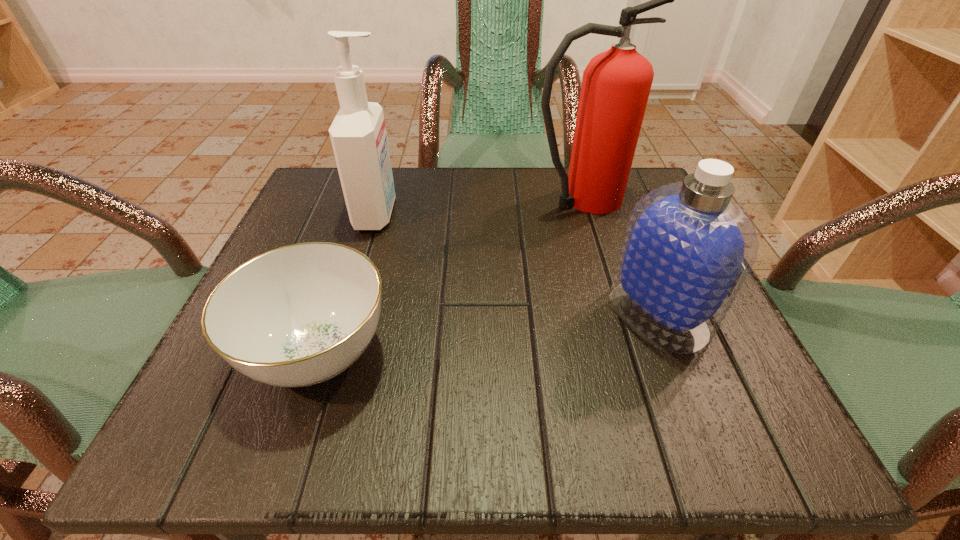
Locate an element on the screen. The height and width of the screenshot is (540, 960). fire extinguisher that is positioned at the far edge is located at coordinates (616, 84).

Where is `cleansing agent that is at the far edge`? The image size is (960, 540). cleansing agent that is at the far edge is located at coordinates (358, 135).

At what (x,y) coordinates should I click in order to perform the action: click on object that is at the near edge. Please return your answer as a coordinate pair (x, y). Looking at the image, I should click on (299, 315).

The width and height of the screenshot is (960, 540). In order to click on cleansing agent that is at the left edge in this screenshot , I will do `click(358, 135)`.

At what (x,y) coordinates should I click in order to perform the action: click on chinaware positioned at the left edge. Please return your answer as a coordinate pair (x, y). The height and width of the screenshot is (540, 960). Looking at the image, I should click on (299, 315).

Where is `fire extinguisher located in the right edge section of the desktop`? fire extinguisher located in the right edge section of the desktop is located at coordinates (616, 84).

The height and width of the screenshot is (540, 960). What are the coordinates of `cleansing agent present at the right edge` in the screenshot? It's located at (688, 248).

Identify the location of object that is at the far left corner. (358, 135).

I want to click on object situated at the near left corner, so click(299, 315).

Locate an element on the screen. object that is at the far right corner is located at coordinates (616, 84).